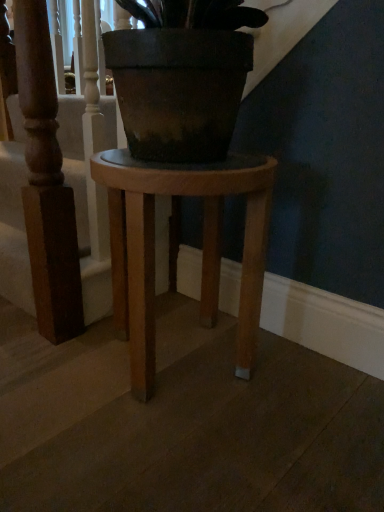
Locate an element on the screen. Image resolution: width=384 pixels, height=512 pixels. wooden stool at center is located at coordinates (203, 246).

Image resolution: width=384 pixels, height=512 pixels. Describe the element at coordinates (203, 246) in the screenshot. I see `wooden stool at center` at that location.

What do you see at coordinates (86, 211) in the screenshot? I see `wooden stool at center` at bounding box center [86, 211].

You are a GUI agent. You are given a task and a screenshot of the screen. Output one action in this format:
    pyautogui.click(x=<x>, y=<y>)
    Task: Click on the wooden stool at center
    The width and height of the screenshot is (384, 512).
    Given the screenshot: What is the action you would take?
    pyautogui.click(x=86, y=211)

The image size is (384, 512). Find the location of `wooden stool at center`. wooden stool at center is located at coordinates (203, 246).

Can you confirm if wooden stool at center is positioned to the left of wooden stool at center?

No.

Is the position of wooden stool at center less distant than that of wooden stool at center?

Yes, it is in front of wooden stool at center.

Between point (125, 298) and point (109, 267), which one is positioned in front?

The point (125, 298) is closer to the camera.

From the image's perspective, is wooden stool at center located above wooden stool at center?

Incorrect, from the image's perspective, wooden stool at center is lower than wooden stool at center.

From a real-world perspective, is wooden stool at center positioned above or below wooden stool at center?

wooden stool at center is situated lower than wooden stool at center in the real world.

Does wooden stool at center have a greater width compared to wooden stool at center?

Yes, wooden stool at center is wider than wooden stool at center.

Considering the relative sizes of wooden stool at center and wooden stool at center in the image provided, is wooden stool at center shorter than wooden stool at center?

Yes, wooden stool at center is shorter than wooden stool at center.

Does wooden stool at center have a larger size compared to wooden stool at center?

Yes.

Is wooden stool at center located within wooden stool at center?

No.

Would you say wooden stool at center is a long distance from wooden stool at center?

That's not correct — wooden stool at center is a little close to wooden stool at center.

From the picture: Is wooden stool at center oriented towards wooden stool at center?

No, wooden stool at center does not turn towards wooden stool at center.

How different are the orientations of wooden stool at center and wooden stool at center in degrees?

They differ by 90.8 degrees in their facing directions.

Consider the image. Measure the distance between wooden stool at center and wooden stool at center.

wooden stool at center is 13.50 inches away from wooden stool at center.

You are a GUI agent. You are given a task and a screenshot of the screen. Output one action in this format:
    pyautogui.click(x=<x>, y=<y>)
    Task: Click on the stool lying on the right of wooden stool at center
    
    Given the screenshot: What is the action you would take?
    pyautogui.click(x=203, y=246)

Which object is positioned more to the right, wooden stool at center or wooden stool at center?

wooden stool at center.

Is the position of wooden stool at center more distant than that of wooden stool at center?

Yes.

Does point (5, 143) lie behind point (207, 273)?

Yes, it is.

From the image's perspective, is wooden stool at center on wooden stool at center?

Yes, from the image's perspective, wooden stool at center is on top of wooden stool at center.

From a real-world perspective, between wooden stool at center and wooden stool at center, who is vertically lower?

wooden stool at center.

Based on the photo, is wooden stool at center wider than wooden stool at center?

No.

In terms of height, does wooden stool at center look taller or shorter compared to wooden stool at center?

Considering their sizes, wooden stool at center has more height than wooden stool at center.

Between wooden stool at center and wooden stool at center, which one has larger size?

wooden stool at center.

Is wooden stool at center spatially inside wooden stool at center, or outside of it?

wooden stool at center is located beyond the bounds of wooden stool at center.

Is wooden stool at center touching wooden stool at center?

wooden stool at center and wooden stool at center are not in contact.

Is wooden stool at center facing towards wooden stool at center?

Yes, wooden stool at center is aimed at wooden stool at center.

How far apart are wooden stool at center and wooden stool at center?

wooden stool at center and wooden stool at center are 13.50 inches apart from each other.

You are a GUI agent. You are given a task and a screenshot of the screen. Output one action in this format:
    pyautogui.click(x=<x>, y=<y>)
    Task: Click on the stairwell behind the wooden stool at center
    The image size is (384, 512).
    Given the screenshot: What is the action you would take?
    pyautogui.click(x=86, y=211)

Locate an element on the screen. stairwell located above the wooden stool at center (from a real-world perspective) is located at coordinates (86, 211).

Identify the location of stool below the wooden stool at center (from a real-world perspective). (203, 246).